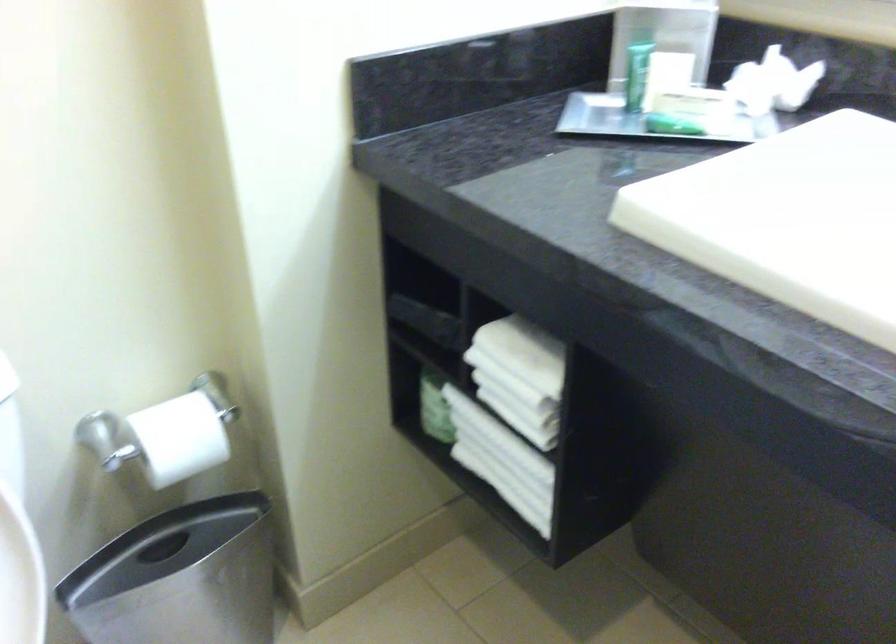
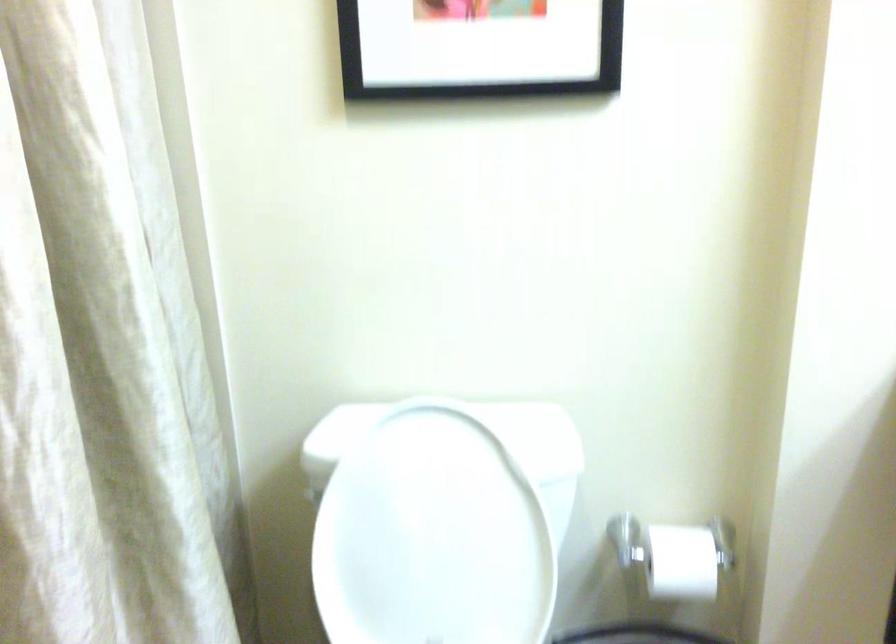
Question: The first image is from the beginning of the video and the second image is from the end. How did the camera likely rotate when shooting the video?

Choices:
 (A) Left
 (B) Right
 (C) Up
 (D) Down

Answer: (A)